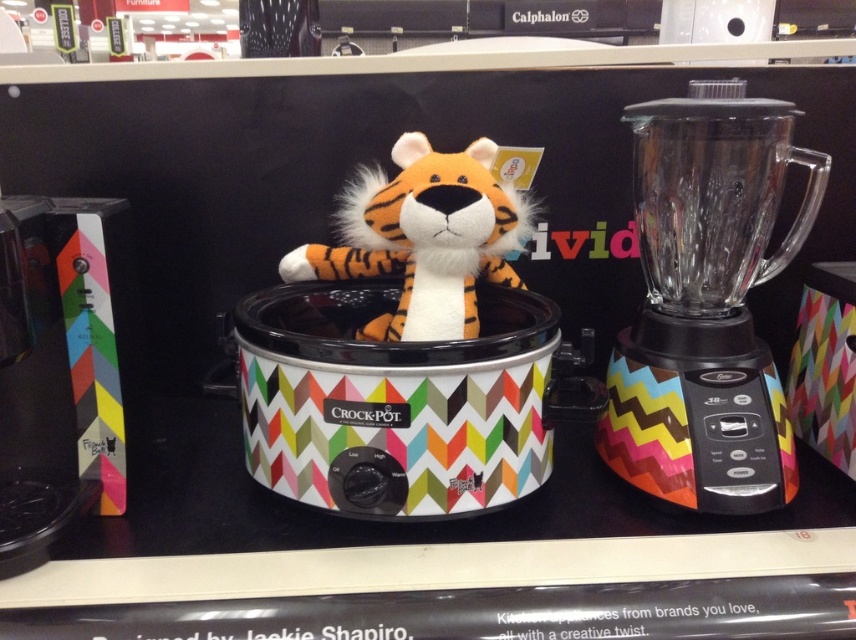
Based on the photo, you are standing in front of the display shelf and need to reach one of the two points marked on the shelf. Which point, point (509,404) or point (676,472), is closer to you?

Point (509,404) is closer to the viewer than point (676,472).

You are a store employee arranging items on a shelf. You have a matte plastic crock pot at center and a clear glass blender at right. Which item has a greater height?

The clear glass blender at right is taller than the matte plastic crock pot at center, so the blender has a greater height.

You are a customer in the store and want to know if the orange plush tiger at center can fit inside the matte plastic crock pot at center. Based on their sizes, can it fit?

The matte plastic crock pot at center is much taller than the orange plush tiger at center, so the tiger should fit inside the crock pot.